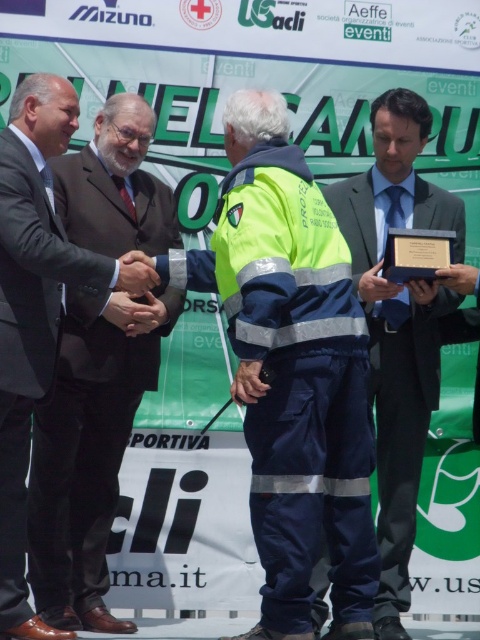
Between high-visibility fabric construction worker at center and matte black suit at left, which one is positioned lower?

Positioned lower is high-visibility fabric construction worker at center.

Is point (323, 276) behind point (60, 346)?

That is False.

At what (x,y) coordinates should I click in order to perform the action: click on high-visibility fabric construction worker at center. Please return your answer as a coordinate pair (x, y). The image size is (480, 640). Looking at the image, I should click on (291, 371).

The image size is (480, 640). What do you see at coordinates (291, 371) in the screenshot?
I see `high-visibility fabric construction worker at center` at bounding box center [291, 371].

Can you confirm if high-visibility fabric construction worker at center is positioned below matte black suit at center?

No.

What do you see at coordinates (291, 371) in the screenshot?
I see `high-visibility fabric construction worker at center` at bounding box center [291, 371].

Image resolution: width=480 pixels, height=640 pixels. What are the coordinates of `high-visibility fabric construction worker at center` in the screenshot? It's located at (291, 371).

Which is behind, point (61, 516) or point (408, 404)?

Positioned behind is point (408, 404).

Measure the distance between matte black suit at left and camera.

matte black suit at left and camera are 9.61 meters apart from each other.

Find the location of a particular element. matte black suit at left is located at coordinates (88, 451).